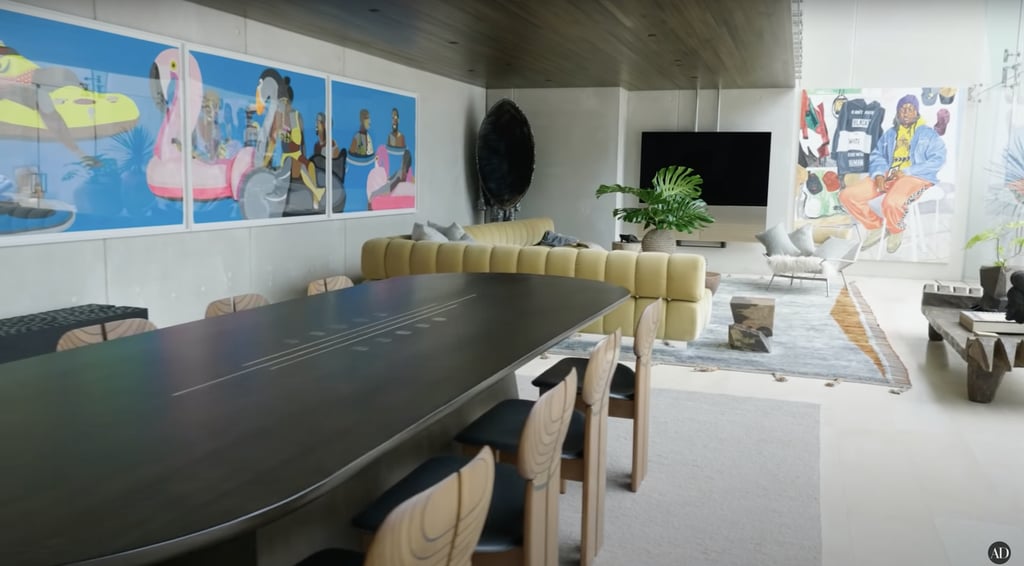
This screenshot has height=566, width=1024. Find the location of `white painted walls`. white painted walls is located at coordinates tap(131, 272), tap(321, 230), tap(592, 134), tap(955, 25).